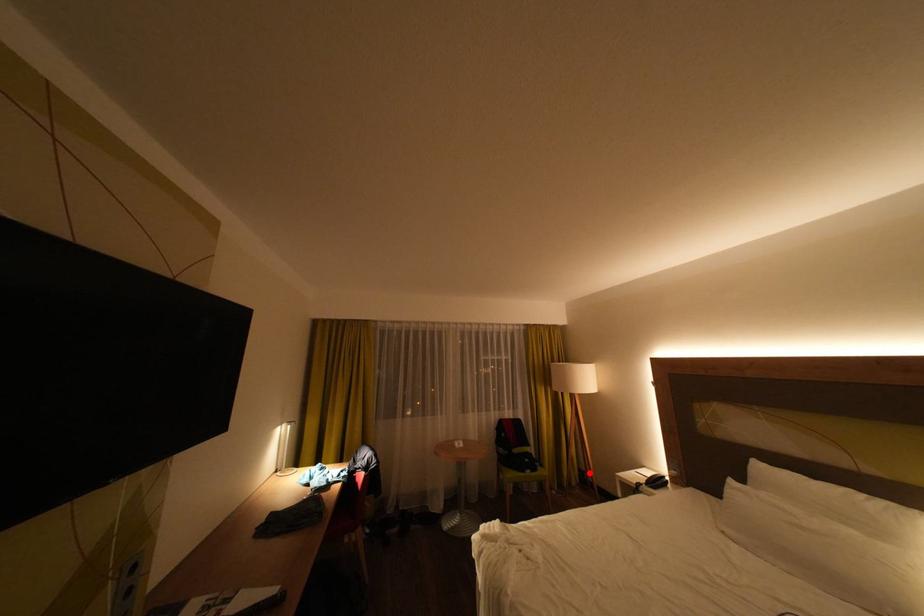
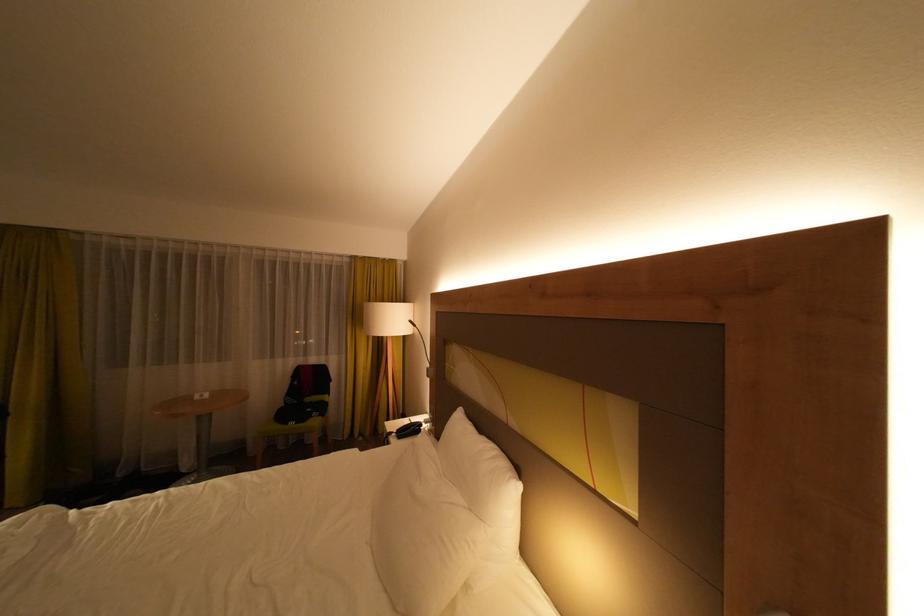
Question: I am providing you with two images of the same scene from different viewpoints. A red point is marked on the first image. At the location where the point appears in image 1, is it still visible in image 2?

Choices:
 (A) Yes
 (B) No

Answer: (B)